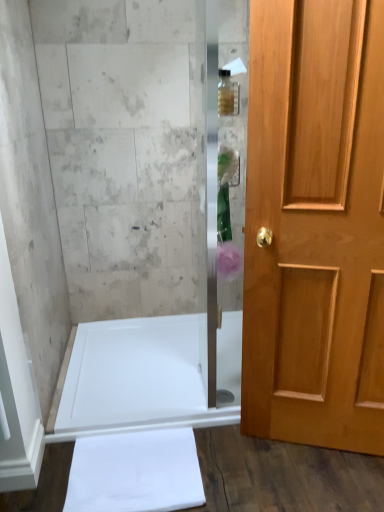
The image size is (384, 512). In order to click on vacant area situated below light brown wooden door at right (from a real-world perspective) in this screenshot , I will do `click(308, 450)`.